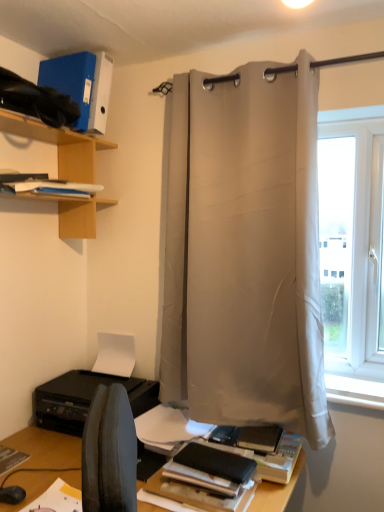
Locate an element on the screen. Image resolution: width=384 pixels, height=512 pixels. white fabric curtain at center is located at coordinates (245, 251).

What do you see at coordinates (245, 251) in the screenshot? The width and height of the screenshot is (384, 512). I see `white fabric curtain at center` at bounding box center [245, 251].

At what (x,y) coordinates should I click in order to perform the action: click on white smooth window sill at lower right. Please return your answer as a coordinate pair (x, y). This screenshot has width=384, height=512. Looking at the image, I should click on (355, 391).

This screenshot has width=384, height=512. What do you see at coordinates (115, 355) in the screenshot?
I see `white matte paper at lower center` at bounding box center [115, 355].

Find the location of `blue matte folder at upper left, the second paperback book when ordered from front to back`. blue matte folder at upper left, the second paperback book when ordered from front to back is located at coordinates (82, 85).

Measure the distance between blue matte folder at upper left, the second paperback book positioned from the bottom, and camera.

blue matte folder at upper left, the second paperback book positioned from the bottom, and camera are 1.61 meters apart from each other.

At what (x,y) coordinates should I click in order to perform the action: click on white paper at left. Please return your answer as a coordinate pair (x, y). The height and width of the screenshot is (512, 384). Looking at the image, I should click on (46, 186).

Locate an element on the screen. The height and width of the screenshot is (512, 384). white fabric curtain at center is located at coordinates (245, 251).

Image resolution: width=384 pixels, height=512 pixels. Identify the location of shower curtain behind the woodenshelving at left. (245, 251).

How many degrees apart are the facing directions of white fabric curtain at center and woodenshelving at left?

88.6 degrees.

Choose the correct answer: Is white fabric curtain at center inside woodenshelving at left or outside it?

white fabric curtain at center is located beyond the bounds of woodenshelving at left.

Which is closer to the camera, (189,262) or (81,176)?

→ Point (189,262).

Locate an element on the screen. book that appears above the white matte paper at lower center (from the image's perspective) is located at coordinates (46, 186).

From a real-world perspective, is white paper at left on white matte paper at lower center?

Correct, in the physical world, white paper at left is higher than white matte paper at lower center.

Is white matte paper at lower center a part of white paper at left?

Actually, white matte paper at lower center is outside white paper at left.

Identify the location of paperback book lying above the white matte paper at lower center (from the image's perspective). (82, 85).

From the picture: Does blue matte folder at upper left, which is the 2th paperback book in right-to-left order, appear on the left side of white matte paper at lower center?

Indeed, blue matte folder at upper left, which is the 2th paperback book in right-to-left order, is positioned on the left side of white matte paper at lower center.

Looking at this image, from a real-world perspective, which is physically below, blue matte folder at upper left, which is the 2th paperback book in right-to-left order, or white matte paper at lower center?

In real-world perspective, white matte paper at lower center is lower.

Which is correct: blue matte folder at upper left, which is the 2th paperback book in right-to-left order, is inside white matte paper at lower center, or outside of it?

The correct answer is: outside.

At what (x,y) coordinates should I click in order to perform the action: click on paperback book above the white paper at left (from a real-world perspective). Please return your answer as a coordinate pair (x, y). This screenshot has width=384, height=512. Looking at the image, I should click on (82, 85).

Is white paper at left positioned behind blue matte folder at upper left, placed as the first paperback book when sorted from top to bottom?

No, white paper at left is closer to the viewer.

From the image's perspective, is white paper at left located above or below blue matte folder at upper left, placed as the first paperback book when sorted from top to bottom?

Clearly, from the image's perspective, white paper at left is below blue matte folder at upper left, placed as the first paperback book when sorted from top to bottom.

Does white paper at left appear on the left side of blue matte folder at upper left, which is counted as the first paperback book, starting from the back?

Correct, you'll find white paper at left to the left of blue matte folder at upper left, which is counted as the first paperback book, starting from the back.

Is point (241, 292) closer or farther from the camera than point (70, 89)?

Point (241, 292) appears to be closer to the viewer than point (70, 89).

How much distance is there between white fabric curtain at center and blue matte folder at upper left, the second paperback book when ordered from front to back?

white fabric curtain at center is 25.47 inches away from blue matte folder at upper left, the second paperback book when ordered from front to back.

I want to click on shower curtain located on the right of blue matte folder at upper left, which is counted as the first paperback book, starting from the back, so click(x=245, y=251).

Can you confirm if white fabric curtain at center is smaller than blue matte folder at upper left, arranged as the 1th paperback book when viewed from the left?

Actually, white fabric curtain at center might be larger than blue matte folder at upper left, arranged as the 1th paperback book when viewed from the left.

The height and width of the screenshot is (512, 384). Identify the location of paperback book in front of the white fabric curtain at center. (192, 494).

Looking at this image, how much distance is there between matte black book at lower center, marked as the 1th paperback book in a right-to-left arrangement, and white fabric curtain at center?

A distance of 29.03 inches exists between matte black book at lower center, marked as the 1th paperback book in a right-to-left arrangement, and white fabric curtain at center.

From the picture: Is white fabric curtain at center located within matte black book at lower center, which is the second paperback book from left to right?

No, white fabric curtain at center is located outside of matte black book at lower center, which is the second paperback book from left to right.

Is matte black book at lower center, placed as the second paperback book when sorted from top to bottom, next to white fabric curtain at center and touching it?

matte black book at lower center, placed as the second paperback book when sorted from top to bottom, and white fabric curtain at center are clearly separated.

Find the location of `shelf above the white paper at left (from the image's perspective)`. shelf above the white paper at left (from the image's perspective) is located at coordinates (60, 145).

Does white paper at left have a lesser height compared to woodenshelving at left?

Correct, white paper at left is not as tall as woodenshelving at left.

Which of these two, white paper at left or woodenshelving at left, is smaller?

white paper at left is smaller.

Are white paper at left and woodenshelving at left beside each other?

They are not placed beside each other.

Image resolution: width=384 pixels, height=512 pixels. Find the location of `shelf that appears above the white fabric curtain at center (from the image's perspective)`. shelf that appears above the white fabric curtain at center (from the image's perspective) is located at coordinates (60, 145).

Find the location of a particular element. The width and height of the screenshot is (384, 512). paper on the right of white paper at left is located at coordinates (115, 355).

Considering their positions, is white smooth window sill at lower right positioned closer to white matte paper at lower center than white fabric curtain at center?

The object closer to white matte paper at lower center is white fabric curtain at center.

Based on their spatial positions, is woodenshelving at left or white fabric curtain at center closer to black matte printer at lower left?

Among the two, white fabric curtain at center is located nearer to black matte printer at lower left.

In the scene shown: Looking at the image, which one is located closer to white matte paper at lower center, white fabric curtain at center or white smooth window sill at lower right?

The object closer to white matte paper at lower center is white fabric curtain at center.

When comparing their distances from woodenshelving at left, does blue matte folder at upper left, which is the 2th paperback book in right-to-left order, or white smooth window sill at lower right seem closer?

blue matte folder at upper left, which is the 2th paperback book in right-to-left order, lies closer to woodenshelving at left than the other object.

Looking at the image, which one is located closer to white paper at left, matte black book at lower center, which is the second paperback book from back to front, or white matte paper at lower center?

white matte paper at lower center is positioned closer to the anchor white paper at left.

Which object lies further to the anchor point white fabric curtain at center, white smooth window sill at lower right or woodenshelving at left?

Among the two, woodenshelving at left is located further to white fabric curtain at center.

When comparing their distances from blue matte folder at upper left, which is the 2th paperback book in right-to-left order, does woodenshelving at left or white matte paper at lower center seem further?

white matte paper at lower center lies further to blue matte folder at upper left, which is the 2th paperback book in right-to-left order, than the other object.

Considering their positions, is white matte paper at lower center positioned further to matte black book at lower center, which is the second paperback book from left to right, than white paper at left?

Based on the image, white paper at left appears to be further to matte black book at lower center, which is the second paperback book from left to right.

This screenshot has height=512, width=384. I want to click on paperback book between black matte printer at lower left and white smooth window sill at lower right in the horizontal direction, so click(192, 494).

The image size is (384, 512). Identify the location of book between woodenshelving at left and black matte printer at lower left from top to bottom. (46, 186).

Identify the location of paper situated between white paper at left and white smooth window sill at lower right from left to right. (115, 355).

This screenshot has height=512, width=384. I want to click on paper between blue matte folder at upper left, placed as the first paperback book when sorted from top to bottom, and white smooth window sill at lower right, in the vertical direction, so click(115, 355).